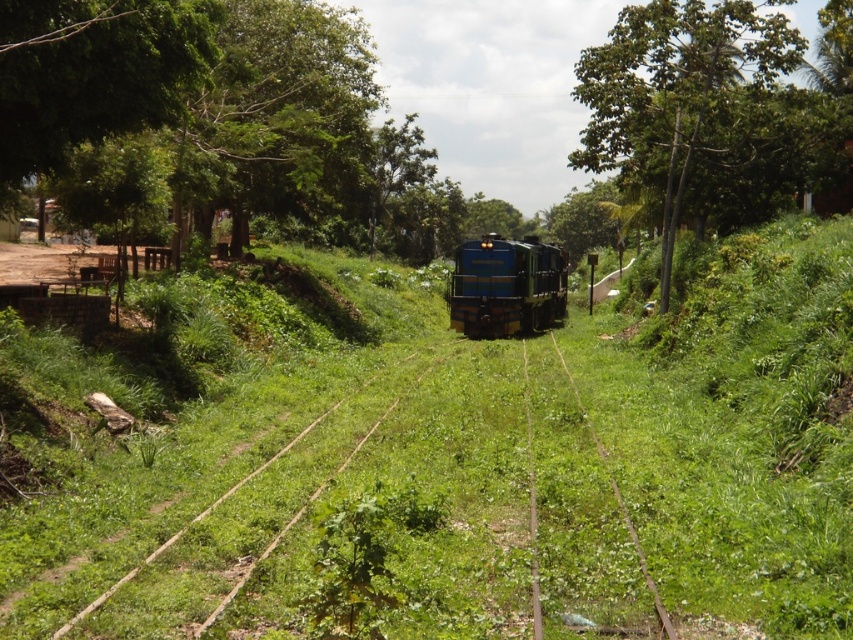
Question: Which point is farther to the camera?

Choices:
 (A) blue glossy train at center
 (B) green leafy tree at upper center

Answer: (A)

Question: Does green leafy tree at upper center appear under blue glossy train at center?

Choices:
 (A) yes
 (B) no

Answer: (B)

Question: Does green leafy tree at upper center come in front of blue glossy train at center?

Choices:
 (A) no
 (B) yes

Answer: (B)

Question: Considering the relative positions of green leafy tree at upper center and blue glossy train at center in the image provided, where is green leafy tree at upper center located with respect to blue glossy train at center?

Choices:
 (A) below
 (B) above

Answer: (B)

Question: Which point is farther to the camera?

Choices:
 (A) green leafy tree at upper center
 (B) blue glossy train at center

Answer: (B)